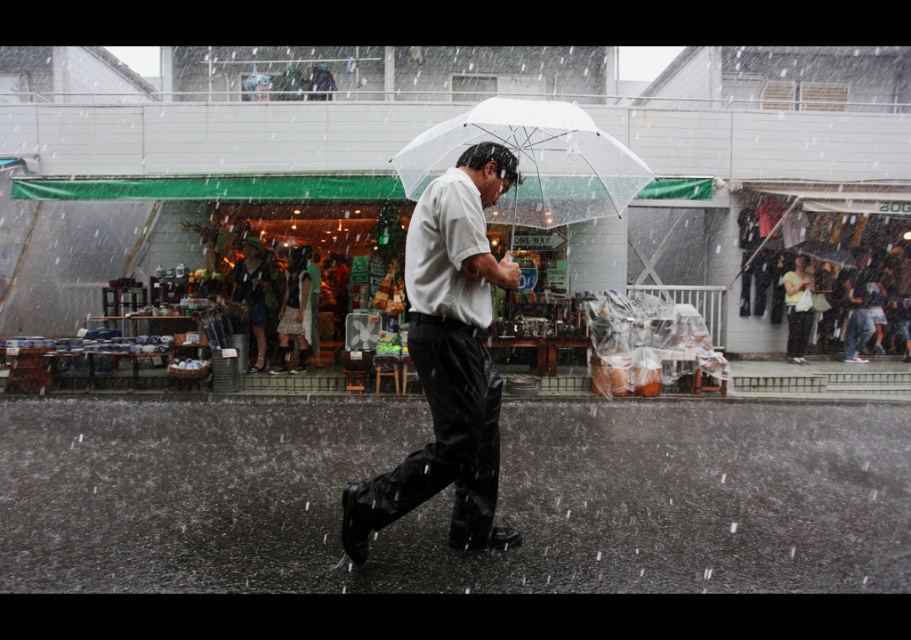
You are a pedestrian trying to stay dry while walking through the rainy street. You have two umbrellas available, the white matte umbrella at center and the transparent plastic umbrella at center. Which umbrella would provide better coverage from the rain?

The white matte umbrella at center is much taller than the transparent plastic umbrella at center, so it would provide better coverage from the rain.

You are a pedestrian trying to stay dry while walking through the rainy street scene. You see both the white matte umbrella at center and the transparent plastic umbrella at center. Which umbrella is positioned lower and might be blocking your view of the path ahead?

The white matte umbrella at center is located below the transparent plastic umbrella at center, so it is positioned lower and might be blocking your view of the path ahead.